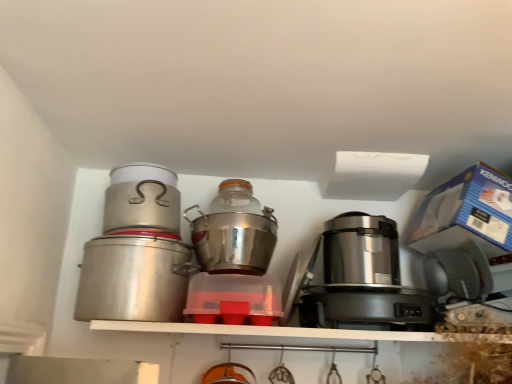
Describe the element at coordinates (366, 307) in the screenshot. I see `satin silver appliance at right, the second appliance in the top-to-bottom sequence` at that location.

At what (x,y) coordinates should I click in order to perform the action: click on shiny metallic pot at center, the 4th kitchen appliance from the left. Please return your answer as a coordinate pair (x, y). This screenshot has height=384, width=512. Looking at the image, I should click on (234, 241).

Is brushed metal canister at left, marked as the first kitchen appliance in a left-to-right arrangement, positioned with its back to brushed metal canister at left, placed as the third kitchen appliance when sorted from right to left?

No.

Between brushed metal canister at left, marked as the first kitchen appliance in a left-to-right arrangement, and brushed metal canister at left, placed as the third kitchen appliance when sorted from right to left, which one appears on the left side from the viewer's perspective?

brushed metal canister at left, marked as the first kitchen appliance in a left-to-right arrangement.

In order to click on kitchen appliance that is the 2nd object directly below the brushed metal canister at left, which is the second kitchen appliance from left to right (from a real-world perspective) in this screenshot , I will do `click(136, 251)`.

From the image's perspective, is brushed metal canister at left, marked as the first kitchen appliance in a left-to-right arrangement, above brushed metal canister at left, which is the second kitchen appliance from left to right?

No, from the image's perspective, brushed metal canister at left, marked as the first kitchen appliance in a left-to-right arrangement, is not on top of brushed metal canister at left, which is the second kitchen appliance from left to right.

Is brushed metal canister at left, placed as the third kitchen appliance when sorted from right to left, located outside transparent plastic container at center, positioned as the second kitchen appliance in right-to-left order?

Yes, brushed metal canister at left, placed as the third kitchen appliance when sorted from right to left, is located beyond the bounds of transparent plastic container at center, positioned as the second kitchen appliance in right-to-left order.

Is the surface of brushed metal canister at left, which is the second kitchen appliance from left to right, in direct contact with transparent plastic container at center, the 3th kitchen appliance when ordered from left to right?

No, brushed metal canister at left, which is the second kitchen appliance from left to right, is not making contact with transparent plastic container at center, the 3th kitchen appliance when ordered from left to right.

Is point (341, 244) closer or farther from the camera than point (119, 217)?

Point (341, 244) is farther from the camera than point (119, 217).

Would you say satin metallic rice cooker at center, which ranks as the 2th appliance in bottom-to-top order, is to the left or to the right of brushed metal canister at left, marked as the first kitchen appliance in a left-to-right arrangement, in the picture?

From the image, it's evident that satin metallic rice cooker at center, which ranks as the 2th appliance in bottom-to-top order, is to the right of brushed metal canister at left, marked as the first kitchen appliance in a left-to-right arrangement.

Where is `appliance above the brushed metal canister at left, the 4th kitchen appliance positioned from the right (from the image's perspective)`? Image resolution: width=512 pixels, height=384 pixels. appliance above the brushed metal canister at left, the 4th kitchen appliance positioned from the right (from the image's perspective) is located at coordinates (361, 249).

Is satin metallic rice cooker at center, which ranks as the 2th appliance in bottom-to-top order, not close to brushed metal canister at left, marked as the first kitchen appliance in a left-to-right arrangement?

satin metallic rice cooker at center, which ranks as the 2th appliance in bottom-to-top order, is near brushed metal canister at left, marked as the first kitchen appliance in a left-to-right arrangement, not far away.

Are transparent plastic container at center, positioned as the second kitchen appliance in right-to-left order, and brushed metal canister at left, placed as the third kitchen appliance when sorted from right to left, located far from each other?

No.

Is transparent plastic container at center, positioned as the second kitchen appliance in right-to-left order, outside of brushed metal canister at left, which is the second kitchen appliance from left to right?

transparent plastic container at center, positioned as the second kitchen appliance in right-to-left order, lies outside brushed metal canister at left, which is the second kitchen appliance from left to right,'s area.

At what (x,y) coordinates should I click in order to perform the action: click on the 2nd kitchen appliance behind the transparent plastic container at center, the 3th kitchen appliance when ordered from left to right, starting your count from the anchor. Please return your answer as a coordinate pair (x, y). The image size is (512, 384). Looking at the image, I should click on (142, 199).

Between satin silver appliance at right, the first appliance positioned from the bottom, and brushed metal canister at left, placed as the third kitchen appliance when sorted from right to left, which one has less height?

satin silver appliance at right, the first appliance positioned from the bottom, is shorter.

Between satin silver appliance at right, the second appliance in the top-to-bottom sequence, and brushed metal canister at left, placed as the third kitchen appliance when sorted from right to left, which one has larger size?

brushed metal canister at left, placed as the third kitchen appliance when sorted from right to left, is bigger.

From the image's perspective, is satin silver appliance at right, the first appliance positioned from the bottom, positioned above or below brushed metal canister at left, placed as the third kitchen appliance when sorted from right to left?

From the image's perspective, satin silver appliance at right, the first appliance positioned from the bottom, appears below brushed metal canister at left, placed as the third kitchen appliance when sorted from right to left.

This screenshot has height=384, width=512. There is a satin silver appliance at right, the second appliance in the top-to-bottom sequence. What are the coordinates of `the 4th kitchen appliance above it (from the image's perspective)` in the screenshot? It's located at (142, 199).

Is satin silver appliance at right, the first appliance positioned from the bottom, facing away from brushed metal canister at left, marked as the first kitchen appliance in a left-to-right arrangement?

No, brushed metal canister at left, marked as the first kitchen appliance in a left-to-right arrangement, is not at the back of satin silver appliance at right, the first appliance positioned from the bottom.

From a real-world perspective, between satin silver appliance at right, the second appliance in the top-to-bottom sequence, and brushed metal canister at left, the 4th kitchen appliance positioned from the right, who is vertically lower?

From a 3D spatial view, satin silver appliance at right, the second appliance in the top-to-bottom sequence, is below.

From the image's perspective, which one is positioned higher, satin silver appliance at right, the first appliance positioned from the bottom, or brushed metal canister at left, marked as the first kitchen appliance in a left-to-right arrangement?

From the image's view, brushed metal canister at left, marked as the first kitchen appliance in a left-to-right arrangement, is above.

Which of these two, satin silver appliance at right, the second appliance in the top-to-bottom sequence, or satin metallic rice cooker at center, placed as the 1th appliance when sorted from top to bottom, is wider?

satin metallic rice cooker at center, placed as the 1th appliance when sorted from top to bottom, is wider.

Is satin silver appliance at right, the second appliance in the top-to-bottom sequence, far away from satin metallic rice cooker at center, placed as the 1th appliance when sorted from top to bottom?

No, satin silver appliance at right, the second appliance in the top-to-bottom sequence, is not far away from satin metallic rice cooker at center, placed as the 1th appliance when sorted from top to bottom.

Can you confirm if satin silver appliance at right, the first appliance positioned from the bottom, is shorter than satin metallic rice cooker at center, which ranks as the 2th appliance in bottom-to-top order?

Indeed, satin silver appliance at right, the first appliance positioned from the bottom, has a lesser height compared to satin metallic rice cooker at center, which ranks as the 2th appliance in bottom-to-top order.

Where is `the 1st kitchen appliance to the right of the brushed metal canister at left, the 4th kitchen appliance positioned from the right, counting from the anchor's position`? the 1st kitchen appliance to the right of the brushed metal canister at left, the 4th kitchen appliance positioned from the right, counting from the anchor's position is located at coordinates tap(142, 199).

The image size is (512, 384). In order to click on the 3rd kitchen appliance positioned above the transparent plastic container at center, positioned as the second kitchen appliance in right-to-left order (from a real-world perspective) in this screenshot , I will do `click(142, 199)`.

Estimate the real-world distances between objects in this image. Which object is closer to transparent plastic container at center, the 3th kitchen appliance when ordered from left to right, satin metallic rice cooker at center, which ranks as the 2th appliance in bottom-to-top order, or brushed metal canister at left, marked as the first kitchen appliance in a left-to-right arrangement?

Among the two, brushed metal canister at left, marked as the first kitchen appliance in a left-to-right arrangement, is located nearer to transparent plastic container at center, the 3th kitchen appliance when ordered from left to right.

Estimate the real-world distances between objects in this image. Which object is further from shiny metallic pot at center, the 4th kitchen appliance from the left, transparent plastic container at center, positioned as the second kitchen appliance in right-to-left order, or satin silver appliance at right, the second appliance in the top-to-bottom sequence?

Based on the image, satin silver appliance at right, the second appliance in the top-to-bottom sequence, appears to be further to shiny metallic pot at center, the 4th kitchen appliance from the left.

When comparing their distances from satin silver appliance at right, the first appliance positioned from the bottom, does satin metallic rice cooker at center, which ranks as the 2th appliance in bottom-to-top order, or brushed metal canister at left, the 4th kitchen appliance positioned from the right, seem closer?

satin metallic rice cooker at center, which ranks as the 2th appliance in bottom-to-top order.

When comparing their distances from satin silver appliance at right, the first appliance positioned from the bottom, does brushed metal canister at left, the 4th kitchen appliance positioned from the right, or satin metallic rice cooker at center, placed as the 1th appliance when sorted from top to bottom, seem closer?

satin metallic rice cooker at center, placed as the 1th appliance when sorted from top to bottom, is positioned closer to the anchor satin silver appliance at right, the first appliance positioned from the bottom.

Considering their positions, is transparent plastic container at center, the 3th kitchen appliance when ordered from left to right, positioned closer to brushed metal canister at left, the 4th kitchen appliance positioned from the right, than brushed metal canister at left, placed as the third kitchen appliance when sorted from right to left?

Based on the image, brushed metal canister at left, placed as the third kitchen appliance when sorted from right to left, appears to be nearer to brushed metal canister at left, the 4th kitchen appliance positioned from the right.

Consider the image. When comparing their distances from satin metallic rice cooker at center, which ranks as the 2th appliance in bottom-to-top order, does brushed metal canister at left, marked as the first kitchen appliance in a left-to-right arrangement, or satin silver appliance at right, the second appliance in the top-to-bottom sequence, seem further?

Based on the image, brushed metal canister at left, marked as the first kitchen appliance in a left-to-right arrangement, appears to be further to satin metallic rice cooker at center, which ranks as the 2th appliance in bottom-to-top order.

Based on their spatial positions, is satin silver appliance at right, the first appliance positioned from the bottom, or transparent plastic container at center, positioned as the second kitchen appliance in right-to-left order, closer to satin metallic rice cooker at center, which ranks as the 2th appliance in bottom-to-top order?

satin silver appliance at right, the first appliance positioned from the bottom, is closer to satin metallic rice cooker at center, which ranks as the 2th appliance in bottom-to-top order.

Which object lies further to the anchor point transparent plastic container at center, positioned as the second kitchen appliance in right-to-left order, shiny metallic pot at center, the 4th kitchen appliance from the left, or brushed metal canister at left, which is the second kitchen appliance from left to right?

Based on the image, brushed metal canister at left, which is the second kitchen appliance from left to right, appears to be further to transparent plastic container at center, positioned as the second kitchen appliance in right-to-left order.

The width and height of the screenshot is (512, 384). Identify the location of kitchen appliance situated between brushed metal canister at left, marked as the first kitchen appliance in a left-to-right arrangement, and transparent plastic container at center, positioned as the second kitchen appliance in right-to-left order, from left to right. (142, 199).

Image resolution: width=512 pixels, height=384 pixels. In order to click on appliance between brushed metal canister at left, marked as the first kitchen appliance in a left-to-right arrangement, and satin metallic rice cooker at center, which ranks as the 2th appliance in bottom-to-top order in this screenshot , I will do `click(366, 307)`.

At what (x,y) coordinates should I click in order to perform the action: click on appliance situated between transparent plastic container at center, positioned as the second kitchen appliance in right-to-left order, and satin metallic rice cooker at center, placed as the 1th appliance when sorted from top to bottom, from left to right. Please return your answer as a coordinate pair (x, y). Image resolution: width=512 pixels, height=384 pixels. Looking at the image, I should click on (366, 307).

Image resolution: width=512 pixels, height=384 pixels. I want to click on appliance situated between brushed metal canister at left, which is the second kitchen appliance from left to right, and satin metallic rice cooker at center, placed as the 1th appliance when sorted from top to bottom, from left to right, so click(366, 307).